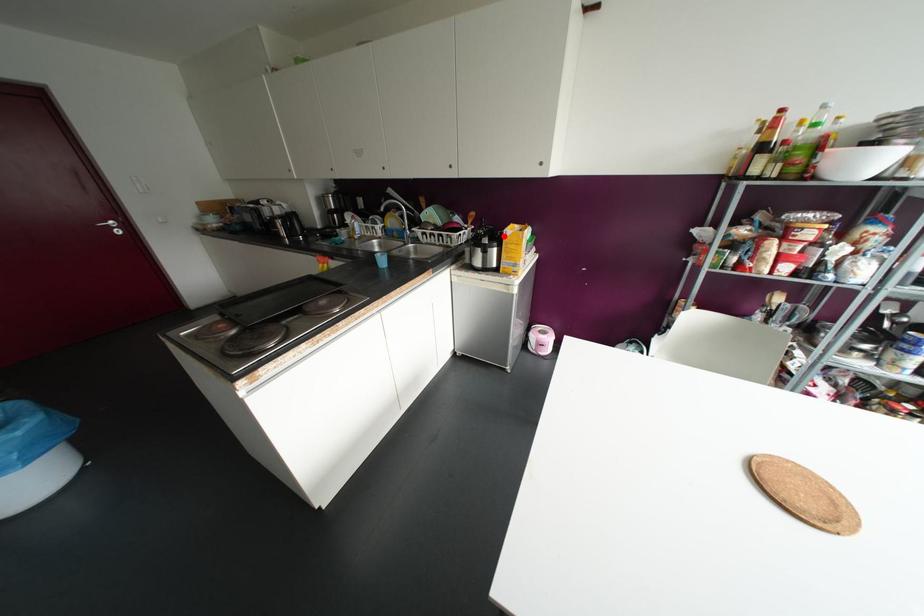
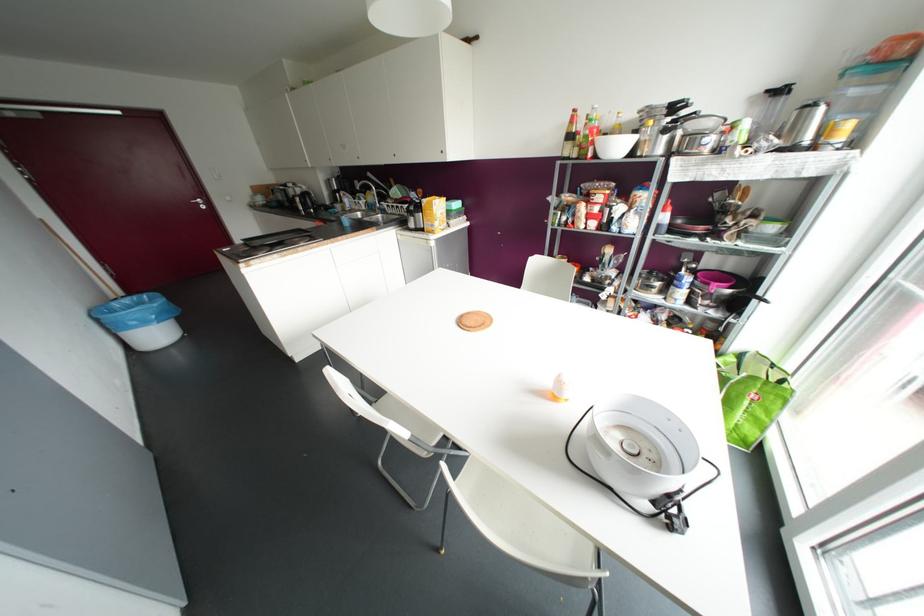
Question: I am providing you with two images of the same scene from different viewpoints. In image1, a red point is highlighted. Considering the same 3D point in image2, which of the following is correct?

Choices:
 (A) It is closer
 (B) It is farther

Answer: (A)